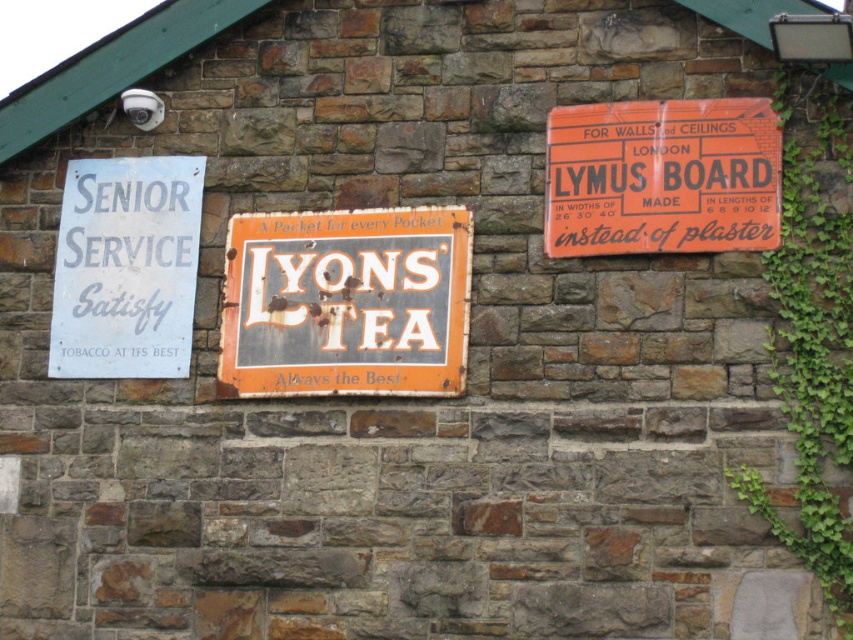
Question: Can you confirm if green leafy ivy at right is positioned below white paper sign at left?

Choices:
 (A) no
 (B) yes

Answer: (B)

Question: Based on their relative distances, which object is nearer to the orange cardboard sign at upper right?

Choices:
 (A) green leafy ivy at right
 (B) white paper sign at left

Answer: (A)

Question: Which of these objects is positioned closest to the green leafy ivy at right?

Choices:
 (A) rusty metal signboard at center
 (B) orange cardboard sign at upper right

Answer: (B)

Question: Where is rusty metal signboard at center located in relation to white paper sign at left in the image?

Choices:
 (A) left
 (B) right

Answer: (B)

Question: Can you confirm if green leafy ivy at right is bigger than white paper sign at left?

Choices:
 (A) yes
 (B) no

Answer: (A)

Question: Which point is closer to the camera taking this photo?

Choices:
 (A) tap(796, 548)
 (B) tap(293, 305)
 (C) tap(558, 163)

Answer: (A)